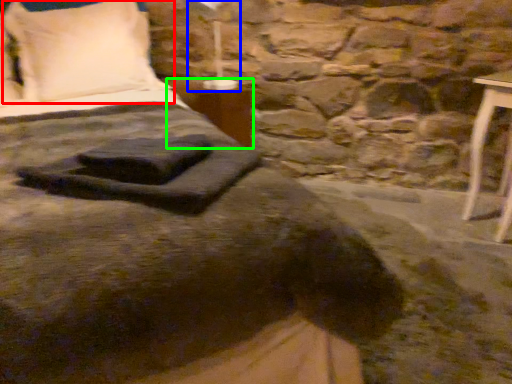
Question: Considering the real-world distances, which object is closest to pillow (highlighted by a red box)? bedside lamp (highlighted by a blue box) or table (highlighted by a green box).

Choices:
 (A) bedside lamp
 (B) table

Answer: (B)